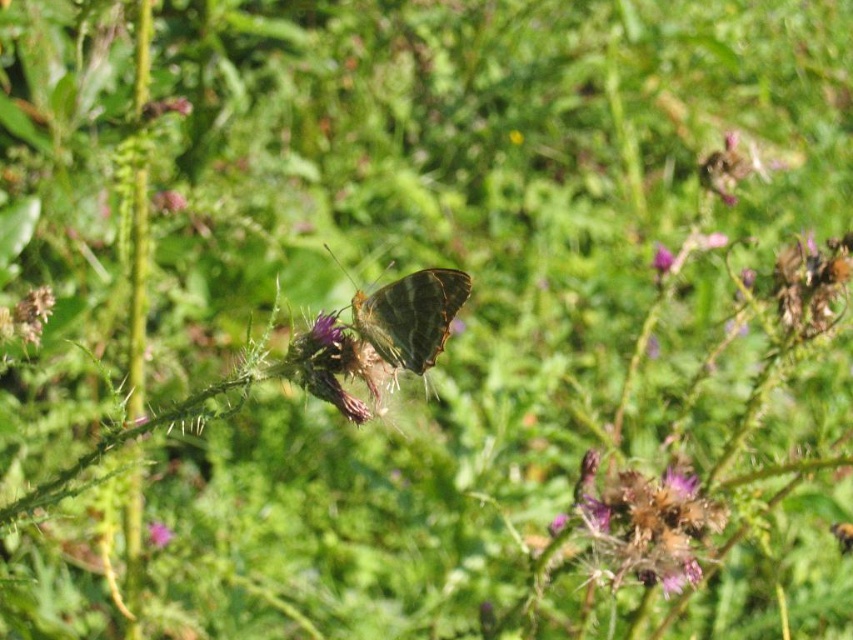
You are an entomologist observing a butterfly in a field. You notice two purple flowers at the center of your view, one labeled as purple fuzzy flower at center and the other as purple matte flower at center. Which flower is larger?

The purple matte flower at center is larger than the purple fuzzy flower at center according to the description.

You are a photographer trying to capture the shiny brown butterfly at center and the purple matte flower at center in a single shot. Which object will appear larger in your photo?

The shiny brown butterfly at center will appear larger in the photo since it has a greater height compared to the purple matte flower at center.

The scene shows a butterfly on a thistle flower in a green field. There is a point at coordinates (x=643, y=524). What object is this point located on?

The point at coordinates (x=643, y=524) is located on the purple fuzzy thistle at center.